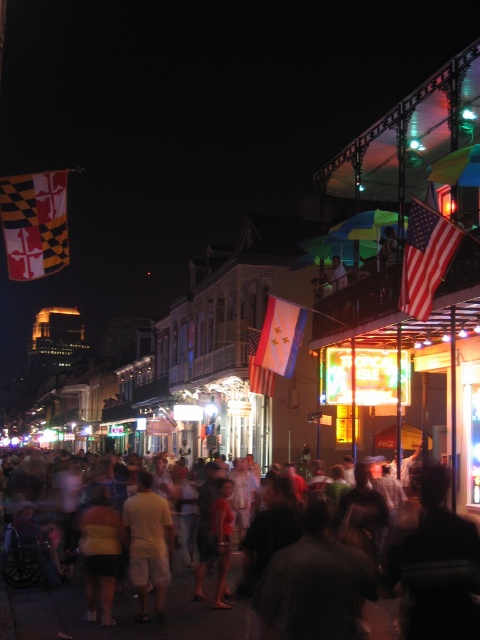
You are a photographer standing in the middle of the street. You want to capture a photo of the light beige shorts at center and the matte white flag at center. Which object is wider in the image?

The light beige shorts at center might be wider than matte white flag at center.